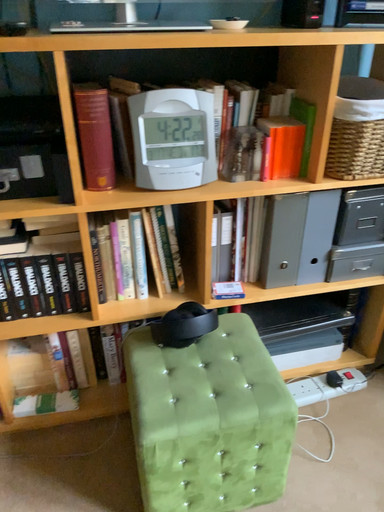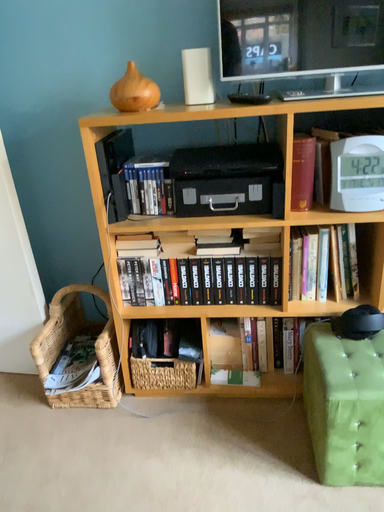
Question: How did the camera likely rotate when shooting the video?

Choices:
 (A) rotated right
 (B) rotated left

Answer: (B)